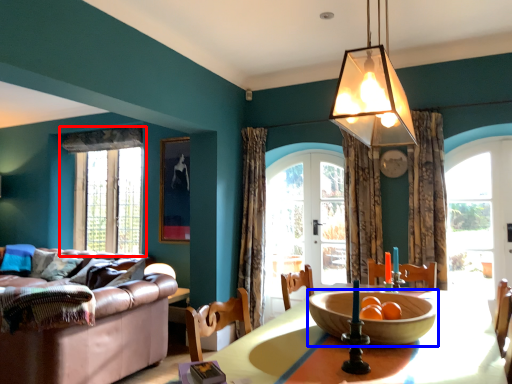
Question: Which of the following is the closest to the observer, window (highlighted by a red box) or bowl (highlighted by a blue box)?

Choices:
 (A) window
 (B) bowl

Answer: (B)